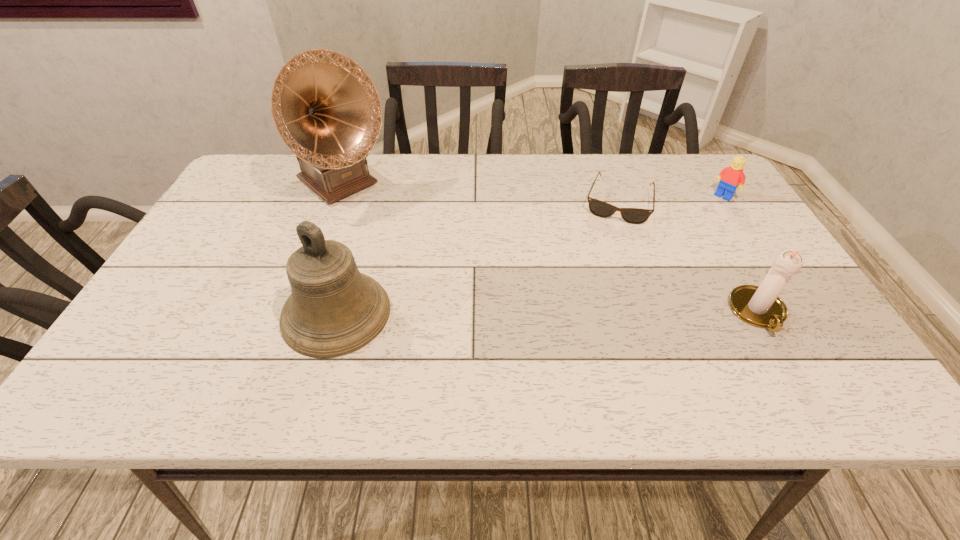
At what (x,y) coordinates should I click in order to perform the action: click on vacant space situated 0.070m on the lenses of the sunglasses. Please return your answer as a coordinate pair (x, y). Looking at the image, I should click on (609, 240).

The image size is (960, 540). What are the coordinates of `vacant area located 0.340m on the lenses of the sunglasses` in the screenshot? It's located at (591, 317).

I want to click on blank area located on the face of the rightmost object, so click(x=662, y=252).

Locate an element on the screen. blank space located 0.350m on the face of the rightmost object is located at coordinates (654, 260).

Where is `vacant region located on the face of the rightmost object`? vacant region located on the face of the rightmost object is located at coordinates (689, 227).

Where is `vacant space situated 0.160m on the horn of the tallest object`? vacant space situated 0.160m on the horn of the tallest object is located at coordinates (403, 234).

Where is `free space located 0.280m on the horn of the tallest object`? This screenshot has width=960, height=540. free space located 0.280m on the horn of the tallest object is located at coordinates (431, 258).

Where is `vacant area situated on the horn of the tallest object`? The image size is (960, 540). vacant area situated on the horn of the tallest object is located at coordinates (415, 244).

In order to click on sunglasses present at the far edge in this screenshot , I will do `click(598, 208)`.

Find the location of a particular element. Lego that is positioned at the far edge is located at coordinates (730, 177).